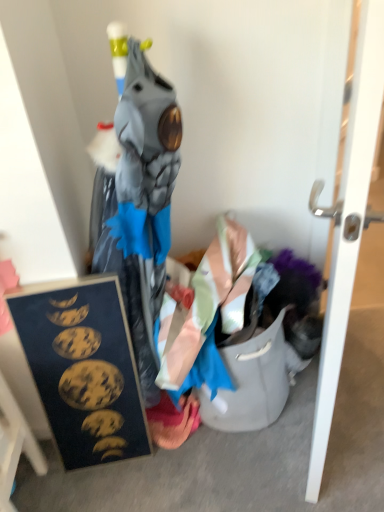
What do you see at coordinates (15, 445) in the screenshot? I see `wooden frame at lower left` at bounding box center [15, 445].

The height and width of the screenshot is (512, 384). What are the coordinates of `white glossy door at right` in the screenshot? It's located at (348, 226).

What do you see at coordinates (348, 226) in the screenshot? I see `white glossy door at right` at bounding box center [348, 226].

Where is `wooden frame at lower left`? This screenshot has height=512, width=384. wooden frame at lower left is located at coordinates (15, 445).

Based on the photo, measure the distance between wooden frame at lower left and pink fabric at lower center.

wooden frame at lower left is 18.32 inches from pink fabric at lower center.

Between wooden frame at lower left and pink fabric at lower center, which one has more height?

Standing taller between the two is wooden frame at lower left.

Who is more distant, wooden frame at lower left or pink fabric at lower center?

pink fabric at lower center.

Is wooden frame at lower left placed right next to pink fabric at lower center?

There is a gap between wooden frame at lower left and pink fabric at lower center.

How different are the orientations of pink fabric at lower center and white glossy door at right in degrees?

There is a 66.6-degree angle between the facing directions of pink fabric at lower center and white glossy door at right.

At what (x,y) coordinates should I click in order to perform the action: click on door above the pink fabric at lower center (from a real-world perspective). Please return your answer as a coordinate pair (x, y). The width and height of the screenshot is (384, 512). Looking at the image, I should click on (348, 226).

Between point (168, 444) and point (324, 354), which one is positioned in front?

The point (324, 354) is in front.

Which is in front, pink fabric at lower center or white glossy door at right?

white glossy door at right is closer to the camera.

From a real-world perspective, is white glossy door at right over wooden frame at lower left?

Yes, from a real-world perspective, white glossy door at right is above wooden frame at lower left.

From the image's perspective, between white glossy door at right and wooden frame at lower left, which one is located above?

white glossy door at right.

At what (x,y) coordinates should I click in order to perform the action: click on furniture on the left side of white glossy door at right. Please return your answer as a coordinate pair (x, y). The width and height of the screenshot is (384, 512). Looking at the image, I should click on [15, 445].

Looking at the image, does wooden frame at lower left seem bigger or smaller compared to white glossy door at right?

wooden frame at lower left is smaller than white glossy door at right.

From a real-world perspective, relative to white glossy door at right, is wooden frame at lower left vertically above or below?

Clearly, from a real-world perspective, wooden frame at lower left is below white glossy door at right.

From the image's perspective, between wooden frame at lower left and white glossy door at right, who is located below?

From the image's view, wooden frame at lower left is below.

What are the coordinates of `furniture on the left side of white glossy door at right` in the screenshot? It's located at (15, 445).

Can you confirm if pink fabric at lower center is thinner than wooden frame at lower left?

No, pink fabric at lower center is not thinner than wooden frame at lower left.

Is there a large distance between pink fabric at lower center and wooden frame at lower left?

pink fabric at lower center is near wooden frame at lower left, not far away.

From the image's perspective, relative to wooden frame at lower left, is pink fabric at lower center above or below?

pink fabric at lower center is situated higher than wooden frame at lower left in the image.

From a real-world perspective, is white glossy door at right below pink fabric at lower center?

No, from a real-world perspective, white glossy door at right is not below pink fabric at lower center.

Is point (333, 372) less distant than point (178, 418)?

Yes.

Is white glossy door at right aimed at pink fabric at lower center?

No, white glossy door at right is not oriented towards pink fabric at lower center.

The image size is (384, 512). Find the location of `furniture that is above the pink fabric at lower center (from a real-world perspective)`. furniture that is above the pink fabric at lower center (from a real-world perspective) is located at coordinates (15, 445).

At what (x,y) coordinates should I click in order to perform the action: click on underclothes below the white glossy door at right (from a real-world perspective). Please return your answer as a coordinate pair (x, y). This screenshot has width=384, height=512. Looking at the image, I should click on pos(173,421).

Which object lies further to the anchor point pink fabric at lower center, wooden frame at lower left or white glossy door at right?

The object further to pink fabric at lower center is white glossy door at right.

Looking at the image, which one is located further to white glossy door at right, wooden frame at lower left or pink fabric at lower center?

wooden frame at lower left.

From the picture: Which object lies further to the anchor point pink fabric at lower center, white glossy door at right or wooden frame at lower left?

white glossy door at right is further to pink fabric at lower center.

Based on their spatial positions, is pink fabric at lower center or wooden frame at lower left further from white glossy door at right?

wooden frame at lower left.

Looking at the image, which one is located closer to wooden frame at lower left, pink fabric at lower center or white glossy door at right?

pink fabric at lower center.

From the image, which object appears to be nearer to wooden frame at lower left, white glossy door at right or pink fabric at lower center?

pink fabric at lower center.

Image resolution: width=384 pixels, height=512 pixels. I want to click on underclothes situated between wooden frame at lower left and white glossy door at right from left to right, so click(173, 421).